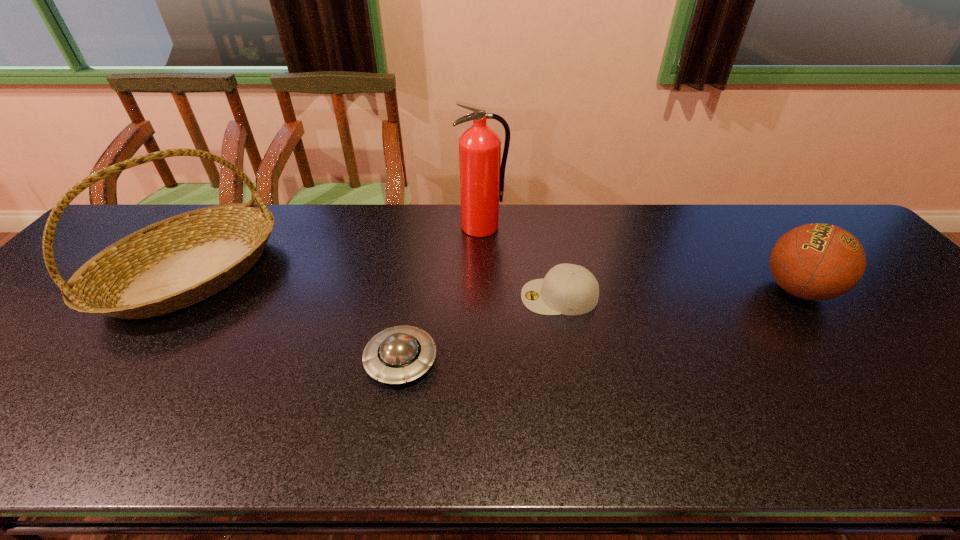
Identify the location of the third object from left to right. Image resolution: width=960 pixels, height=540 pixels. (482, 173).

Locate an element on the screen. the leftmost object is located at coordinates (177, 262).

Find the location of `the rightmost object`. the rightmost object is located at coordinates (817, 261).

The image size is (960, 540). Identify the location of the third tallest object. (817, 261).

Image resolution: width=960 pixels, height=540 pixels. I want to click on cap, so click(x=568, y=289).

Where is `saucer`? Image resolution: width=960 pixels, height=540 pixels. saucer is located at coordinates (x=395, y=355).

Identify the location of the fourth object from right to left. This screenshot has width=960, height=540. (395, 355).

The width and height of the screenshot is (960, 540). What are the coordinates of `free region located 0.330m at the nozzle of the third object from right to left` in the screenshot? It's located at (482, 320).

Identify the location of vacant area situated on the right of the basket. (372, 273).

This screenshot has height=540, width=960. Find the location of `vacant area situated on the front of the basketball`. vacant area situated on the front of the basketball is located at coordinates (866, 379).